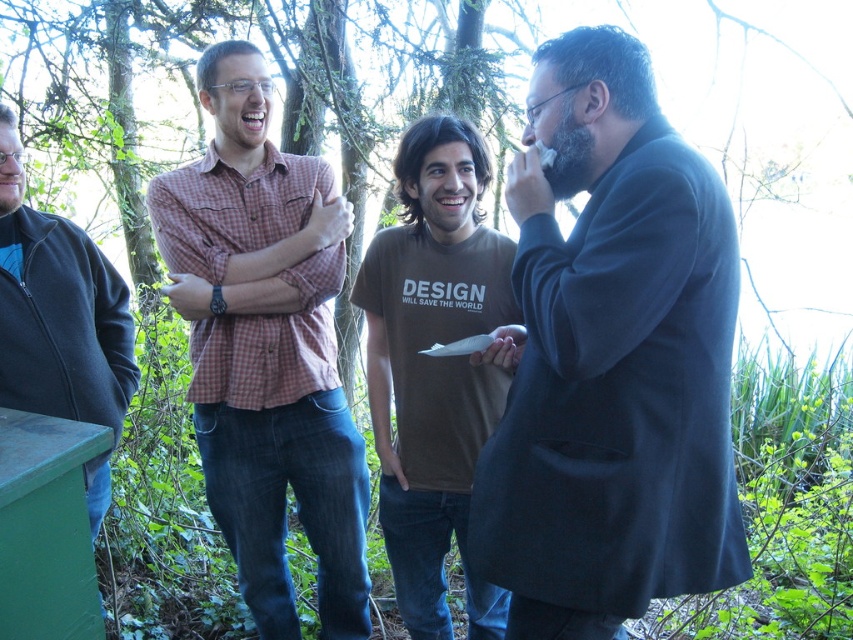
You are standing in a park and see a group of people. There is a point at coordinates (265, 348). What is the object located at this point?

The point (265, 348) corresponds to the checkered fabric shirt at center.